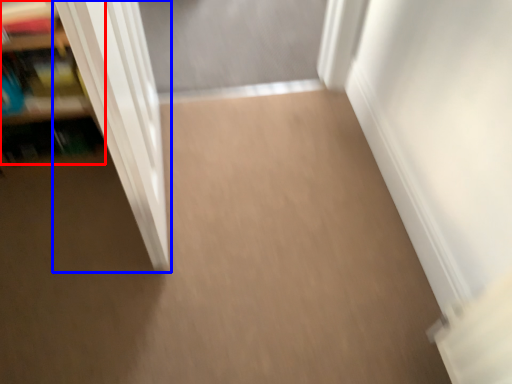
Question: Among these objects, which one is farthest to the camera, shelf (highlighted by a red box) or door (highlighted by a blue box)?

Choices:
 (A) shelf
 (B) door

Answer: (A)